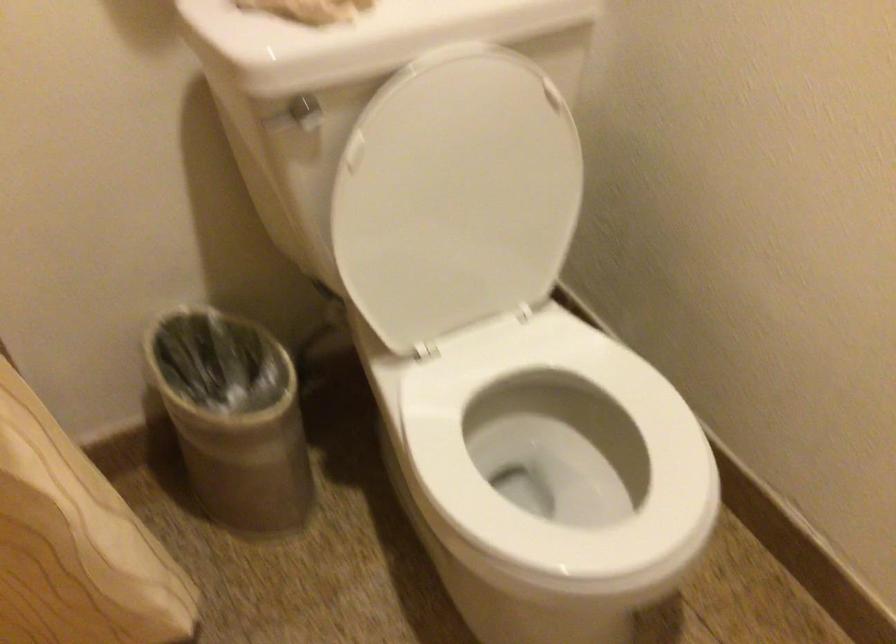
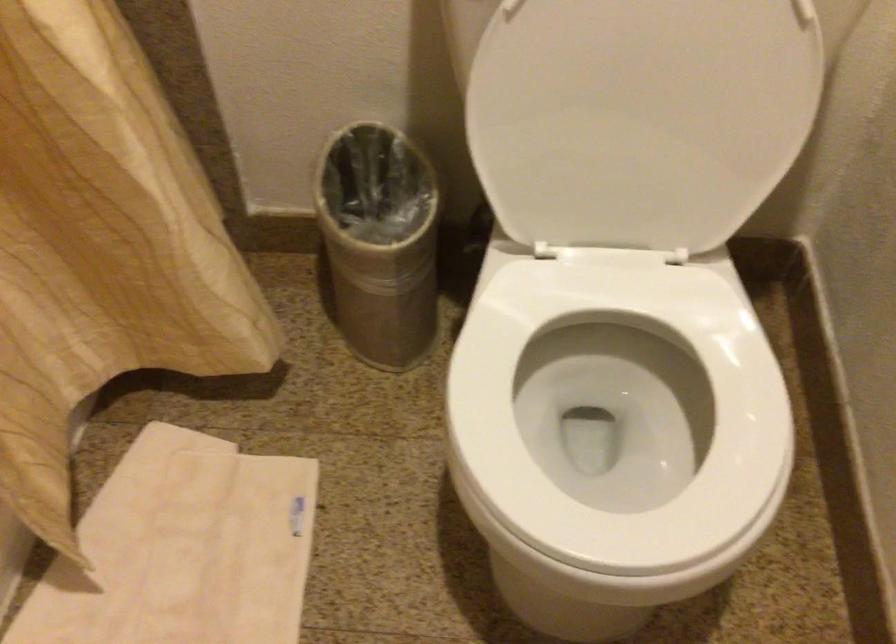
Locate, in the second image, the point that corresponds to [467,216] in the first image.

(640, 118)